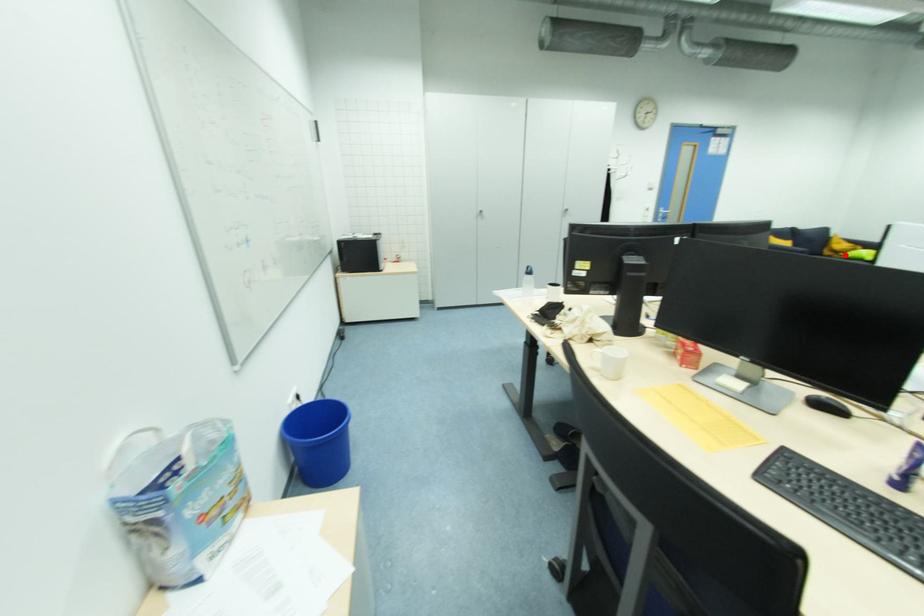
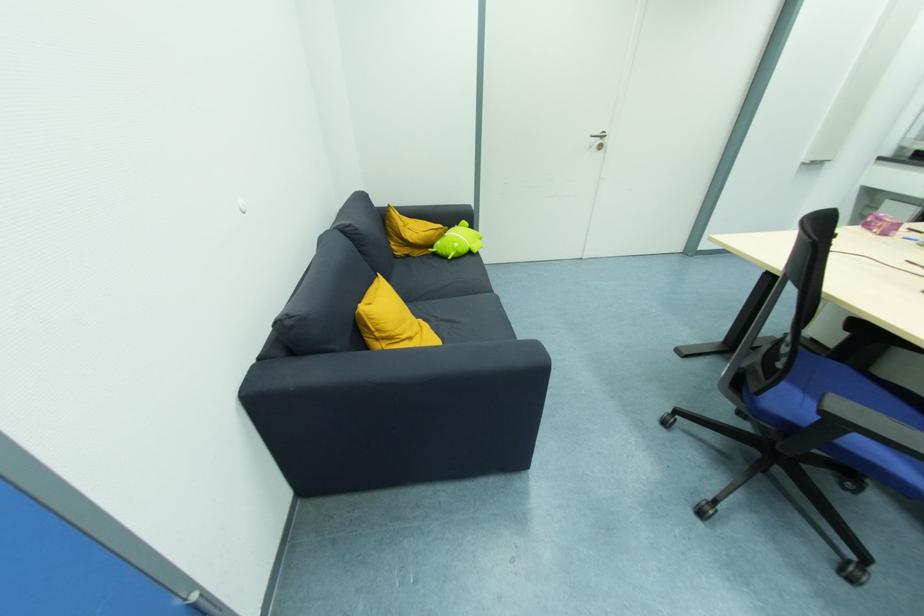
Question: I am providing you with two images of the same scene from different viewpoints. In image1, a red point is highlighted. Considering the same 3D point in image2, which of the following is correct?

Choices:
 (A) It is closer
 (B) It is farther

Answer: (A)